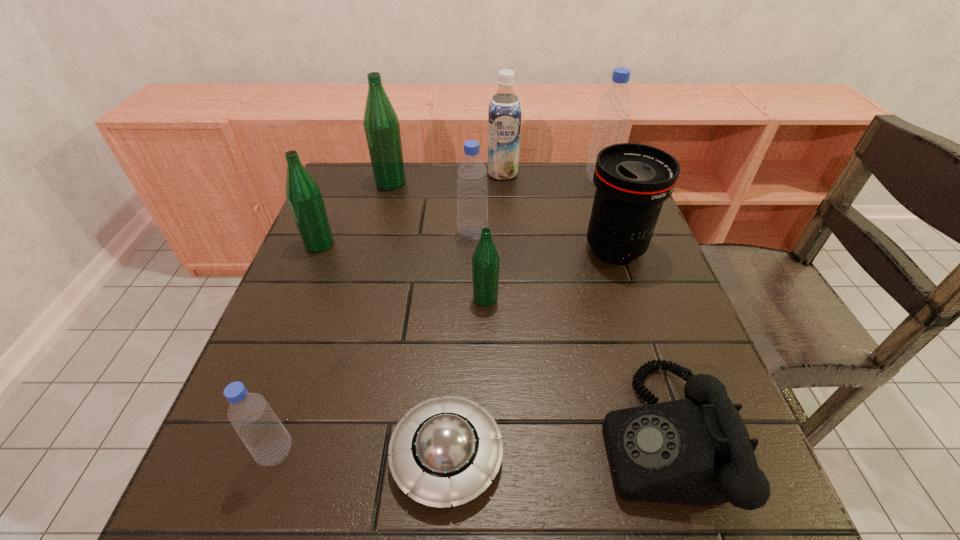
Where is `empty space that is in between the gray saucer and the second smallest green bottle`? empty space that is in between the gray saucer and the second smallest green bottle is located at coordinates (383, 350).

You are a GUI agent. You are given a task and a screenshot of the screen. Output one action in this format:
    pyautogui.click(x=<x>, y=<y>)
    Task: Click on the free space between the second farthest blue bottle and the leftmost blue bottle
    This screenshot has height=540, width=960.
    Given the screenshot: What is the action you would take?
    pyautogui.click(x=374, y=343)

Locate an element on the screen. empty space between the biggest green bottle and the smallest green bottle is located at coordinates (438, 240).

Identify which object is the eighth closest to the farthest green bottle. Please provide its 2D coordinates. Your answer should be formatted as a tuple, i.e. [(x, y)], where the tuple contains the x and y coordinates of a point satisfying the conditions above.

[(695, 451)]

Point out which object is positioned as the sixth nearest to the telephoto lens. Please provide its 2D coordinates. Your answer should be formatted as a tuple, i.e. [(x, y)], where the tuple contains the x and y coordinates of a point satisfying the conditions above.

[(446, 450)]

I want to click on bottle that is the second closest one to the rightmost green bottle, so click(303, 194).

Select which bottle is the fifth closest to the leftmost green bottle. Please provide its 2D coordinates. Your answer should be formatted as a tuple, i.e. [(x, y)], where the tuple contains the x and y coordinates of a point satisfying the conditions above.

[(614, 108)]

Identify the location of the second closest blue bottle to the leftmost blue bottle. (614, 108).

Identify which blue bottle is the second nearest to the soya milk. Please provide its 2D coordinates. Your answer should be formatted as a tuple, i.e. [(x, y)], where the tuple contains the x and y coordinates of a point satisfying the conditions above.

[(472, 193)]

Locate which green bottle is the second closest to the telephoto lens. Please provide its 2D coordinates. Your answer should be formatted as a tuple, i.e. [(x, y)], where the tuple contains the x and y coordinates of a point satisfying the conditions above.

[(381, 124)]